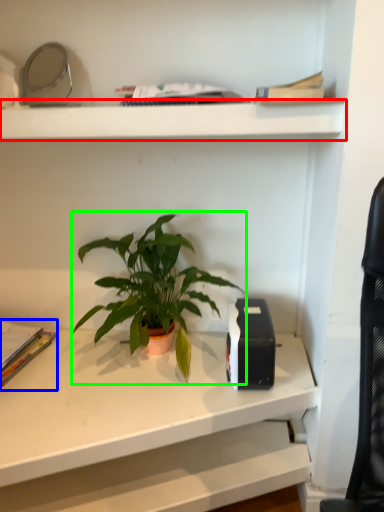
Question: Based on their relative distances, which object is nearer to shelf (highlighted by a red box)? Choose from paperback book (highlighted by a blue box) and houseplant (highlighted by a green box).

Choices:
 (A) paperback book
 (B) houseplant

Answer: (B)